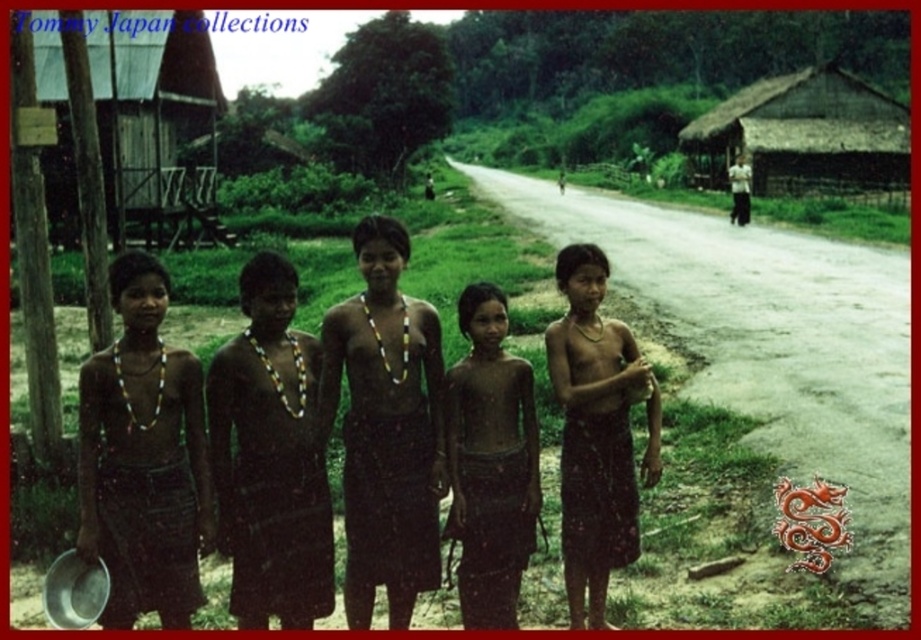
Question: In this image, where is brown woven skirt at left located relative to thatched brown hut at upper right?

Choices:
 (A) right
 (B) left

Answer: (B)

Question: Is brown matte skin at center positioned before thatched brown hut at upper right?

Choices:
 (A) yes
 (B) no

Answer: (A)

Question: Which is farther from the brown woven skirt at center?

Choices:
 (A) gray asphalt road at center
 (B) brown woven skirt at left

Answer: (A)

Question: Does brown woven skirt at left appear on the left side of wooden hut at left?

Choices:
 (A) no
 (B) yes

Answer: (A)

Question: Which object appears closest to the camera in this image?

Choices:
 (A) brown fabric skirt at center
 (B) dark brown skin at center
 (C) brown woven skirt at left
 (D) brown matte skin at center

Answer: (C)

Question: Which of the following is the closest to the observer?

Choices:
 (A) brown matte skin at center
 (B) brown woven skirt at center
 (C) gray asphalt road at center

Answer: (A)